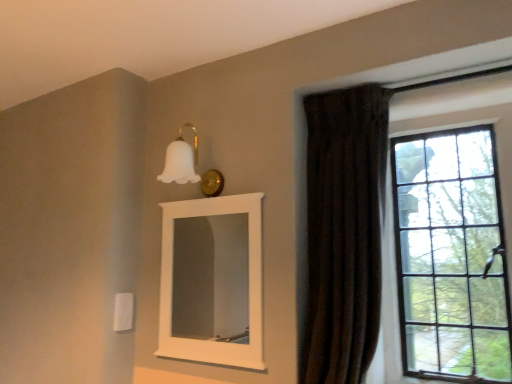
Question: Does white matte mirror at upper center lie in front of white matte glass sconce at upper center?

Choices:
 (A) yes
 (B) no

Answer: (A)

Question: Does white matte mirror at upper center lie behind white matte glass sconce at upper center?

Choices:
 (A) yes
 (B) no

Answer: (B)

Question: Is white matte mirror at upper center oriented towards white matte glass sconce at upper center?

Choices:
 (A) no
 (B) yes

Answer: (A)

Question: Is white matte mirror at upper center smaller than white matte glass sconce at upper center?

Choices:
 (A) no
 (B) yes

Answer: (A)

Question: Does white matte mirror at upper center have a lesser height compared to white matte glass sconce at upper center?

Choices:
 (A) no
 (B) yes

Answer: (A)

Question: Does white matte mirror at upper center have a lesser width compared to white matte glass sconce at upper center?

Choices:
 (A) yes
 (B) no

Answer: (A)

Question: Is the depth of brown velvet curtain at right greater than that of white matte glass sconce at upper center?

Choices:
 (A) no
 (B) yes

Answer: (A)

Question: Is brown velvet curtain at right wider than white matte glass sconce at upper center?

Choices:
 (A) yes
 (B) no

Answer: (B)

Question: Can you confirm if brown velvet curtain at right is smaller than white matte glass sconce at upper center?

Choices:
 (A) no
 (B) yes

Answer: (A)

Question: From a real-world perspective, is brown velvet curtain at right positioned over white matte glass sconce at upper center based on gravity?

Choices:
 (A) no
 (B) yes

Answer: (A)

Question: Does brown velvet curtain at right contain white matte glass sconce at upper center?

Choices:
 (A) yes
 (B) no

Answer: (B)

Question: From the image's perspective, would you say brown velvet curtain at right is positioned over white matte glass sconce at upper center?

Choices:
 (A) yes
 (B) no

Answer: (B)

Question: Does white matte mirror at upper center come behind clear glass window at right?

Choices:
 (A) yes
 (B) no

Answer: (A)